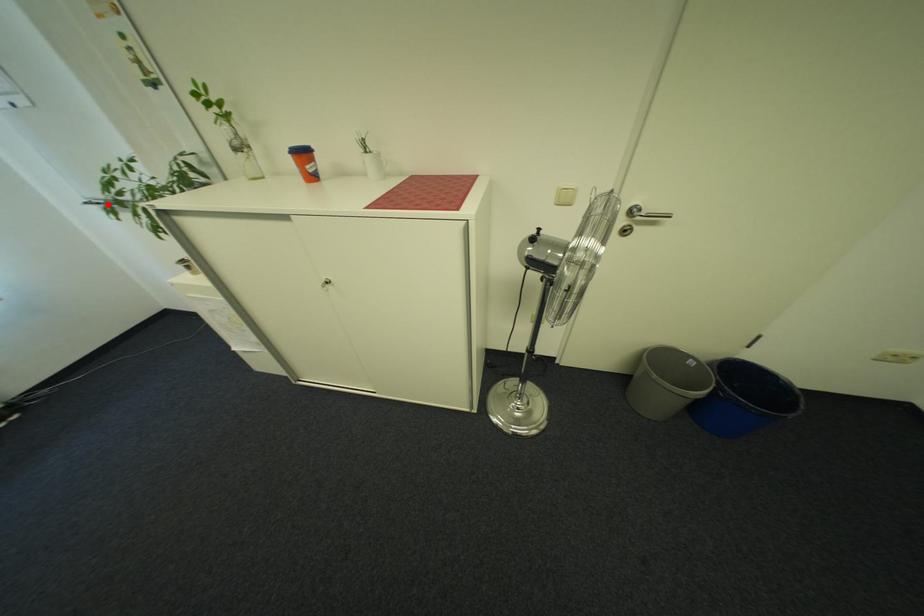
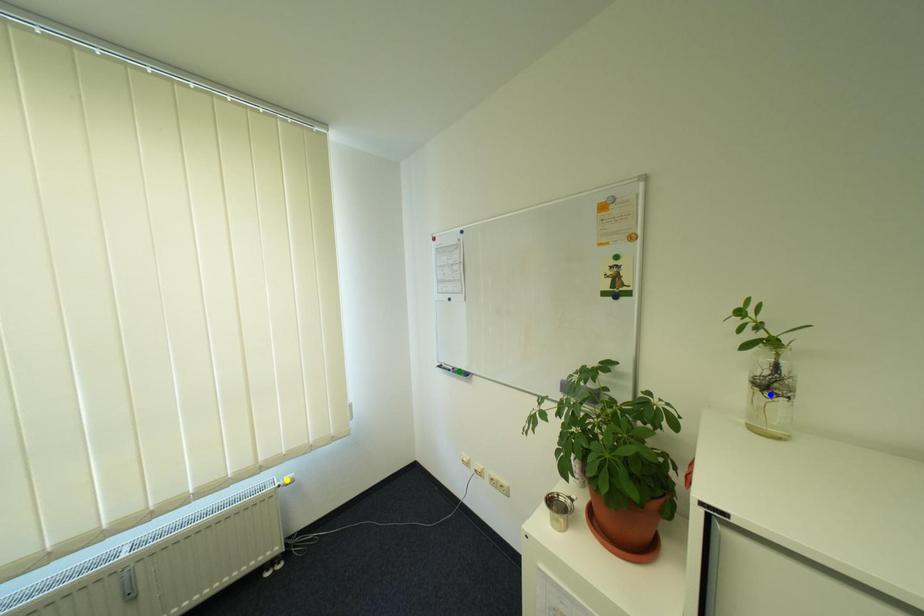
Question: I am providing you with two images of the same scene from different viewpoints. A red point is marked on the first image. You are given multiple points on the second image. Which point in image 2 represents the same 3d spot as the red point in image 1?

Choices:
 (A) blue point
 (B) yellow point
 (C) green point

Answer: (C)